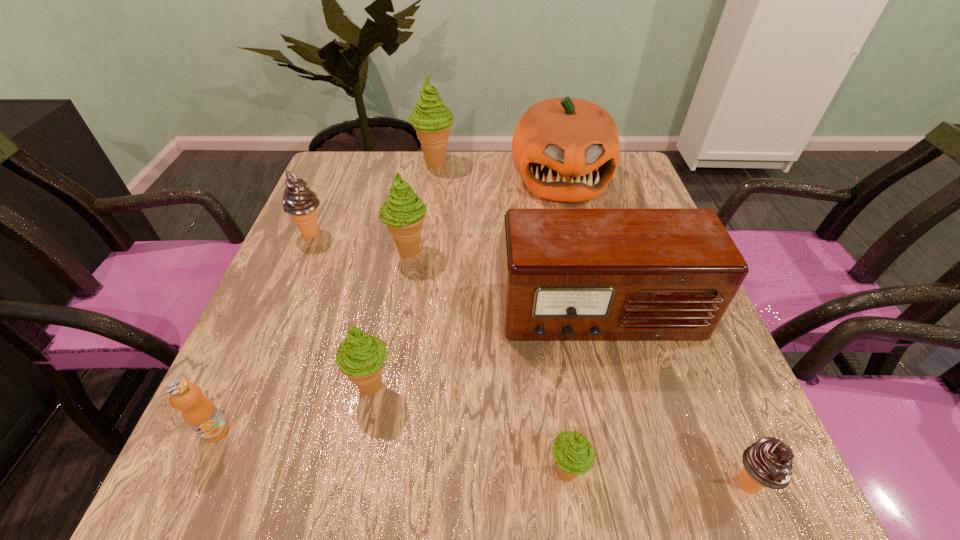
Where is `the farthest icecream`? Image resolution: width=960 pixels, height=540 pixels. the farthest icecream is located at coordinates (431, 119).

At what (x,y) coordinates should I click in order to perform the action: click on the tallest icecream. Please return your answer as a coordinate pair (x, y). This screenshot has height=540, width=960. Looking at the image, I should click on (431, 119).

The image size is (960, 540). Identify the location of pumpkin. (566, 149).

At what (x,y) coordinates should I click in order to perform the action: click on the second farthest green icecream. Please return your answer as a coordinate pair (x, y). This screenshot has width=960, height=540. Looking at the image, I should click on (403, 212).

Where is `the fifth shortest icecream`? the fifth shortest icecream is located at coordinates (403, 212).

Where is `radio receiver`? radio receiver is located at coordinates (567, 274).

Find the location of `the leftmost icecream`. the leftmost icecream is located at coordinates (301, 203).

Locate an element on the screen. the left chocolate icecream is located at coordinates (301, 203).

Where is `the fourth nearest object`? the fourth nearest object is located at coordinates (360, 357).

Find the location of a particular element. This screenshot has width=960, height=540. the second smallest green icecream is located at coordinates (360, 357).